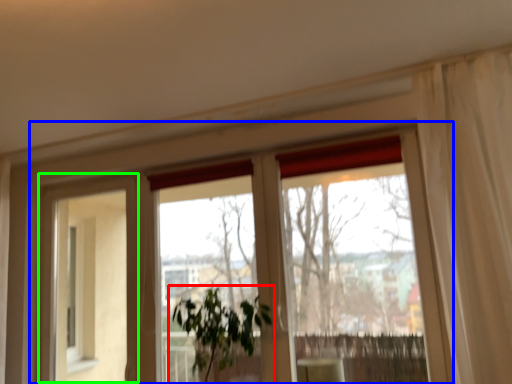
Question: Estimate the real-world distances between objects in this image. Which object is closer to houseplant (highlighted by a red box), window (highlighted by a blue box) or screen door (highlighted by a green box)?

Choices:
 (A) window
 (B) screen door

Answer: (A)